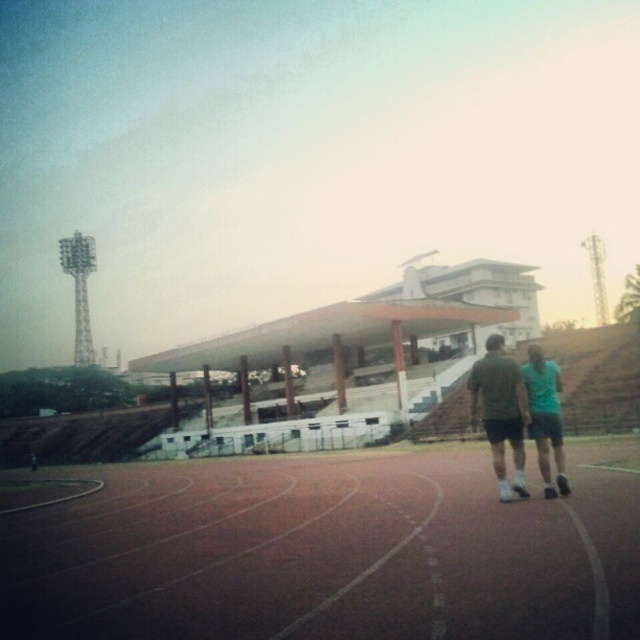
You are an athlete preparing for a sprint and need to know the size of the brown rubber track at center and the teal fabric shorts at right. Which one is smaller in size?

The brown rubber track at center has a smaller size compared to the teal fabric shorts at right.

Looking at this image, you are standing at the edge of the field and see the brown rubber track at center and the dark gray shorts at center. Which object is positioned to the left when viewed from your perspective?

The brown rubber track at center is to the left of the dark gray shorts at center.